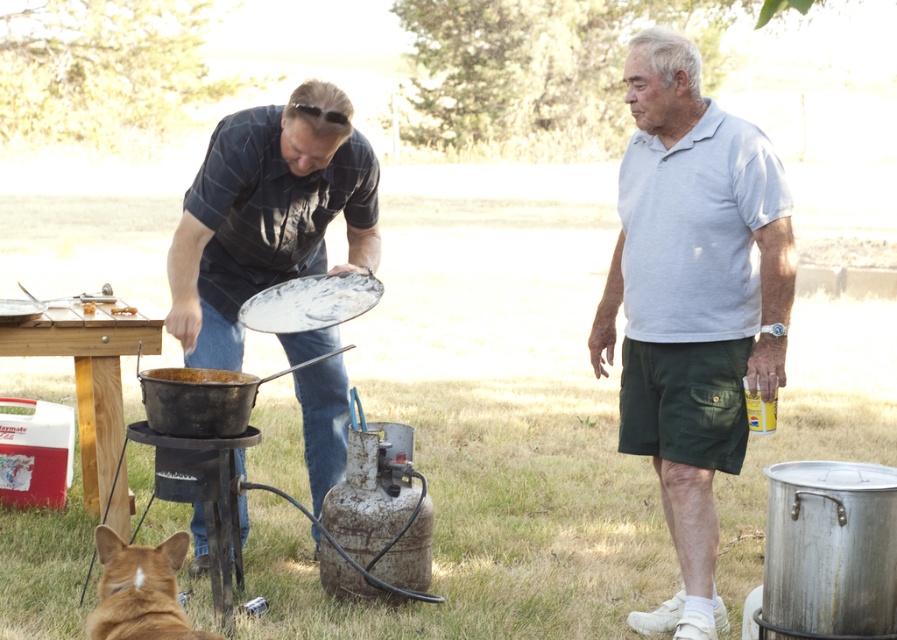
Between brown fur at lower left and rusty metal pot at lower left, which one is positioned lower?

brown fur at lower left

Is brown fur at lower left to the left of rusty metal pot at lower left from the viewer's perspective?

In fact, brown fur at lower left is to the right of rusty metal pot at lower left.

Measure the distance between point (103, 625) and camera.

Point (103, 625) is 3.22 meters from camera.

Locate an element on the screen. Image resolution: width=897 pixels, height=640 pixels. brown fur at lower left is located at coordinates (138, 589).

Is wooden picnic table at lower left closer to camera compared to rusty metal barbecue grill at lower left?

No, wooden picnic table at lower left is further to the viewer.

Between point (105, 323) and point (229, 596), which one is positioned behind?

The point (105, 323) is behind.

The height and width of the screenshot is (640, 897). I want to click on wooden picnic table at lower left, so click(91, 376).

Who is taller, white cotton shirt at center or wooden picnic table at lower left?

With more height is white cotton shirt at center.

Does white cotton shirt at center appear under wooden picnic table at lower left?

Incorrect, white cotton shirt at center is not positioned below wooden picnic table at lower left.

Is point (646, 228) in front of point (138, 300)?

Yes, it is.

I want to click on white cotton shirt at center, so click(692, 301).